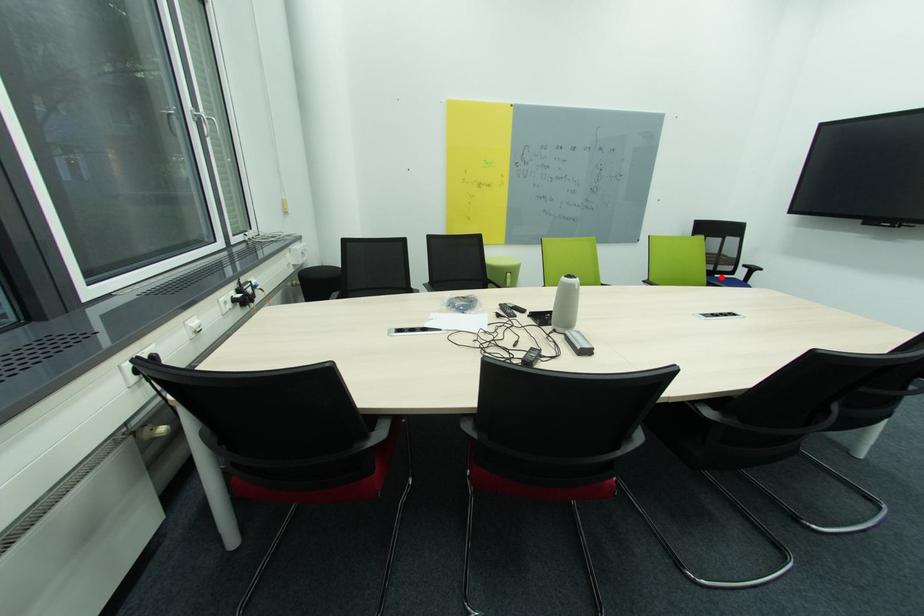
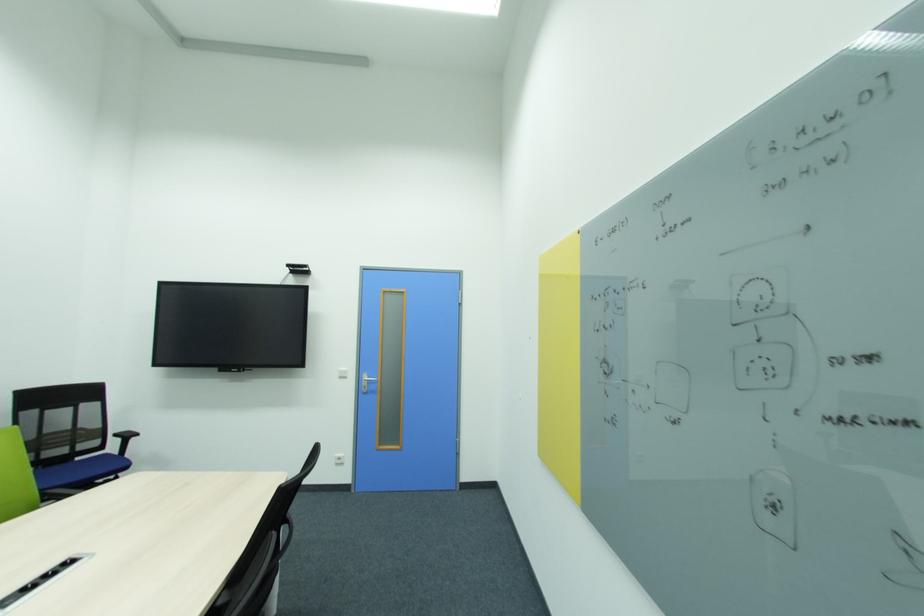
Question: I am providing you with two images of the same scene from different viewpoints. A red point is marked on the first image. Can you still see the location of the red point in image 2?

Choices:
 (A) Yes
 (B) No

Answer: (A)